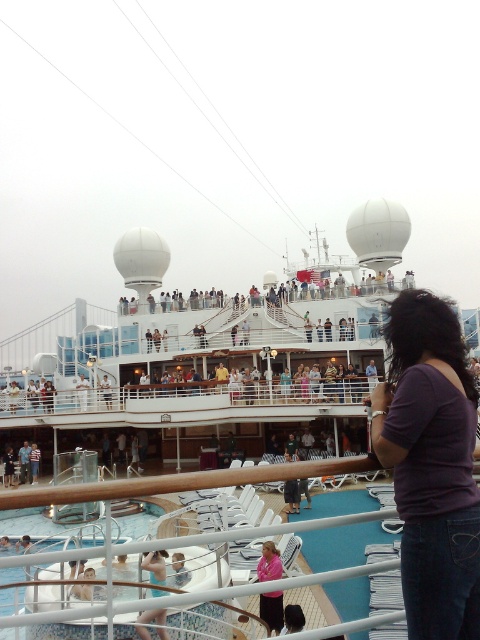
Which is more to the right, purple matte shirt at lower right or pink fabric shirt at lower center?

Positioned to the right is purple matte shirt at lower right.

Looking at this image, between purple matte shirt at lower right and pink fabric shirt at lower center, which one appears on the left side from the viewer's perspective?

pink fabric shirt at lower center

Does point (418, 500) come closer to viewer compared to point (280, 602)?

Yes.

Find the location of `purple matte shirt at lower right`. purple matte shirt at lower right is located at coordinates (432, 465).

Between purple matte shirt at lower right and light blue swimsuit at lower center, which one has more height?

Standing taller between the two is purple matte shirt at lower right.

The image size is (480, 640). In order to click on purple matte shirt at lower right in this screenshot , I will do `click(432, 465)`.

Is point (276, 561) positioned after point (152, 563)?

Yes, it is behind point (152, 563).

Can you confirm if pink fabric shirt at lower center is wider than light blue swimsuit at lower center?

In fact, pink fabric shirt at lower center might be narrower than light blue swimsuit at lower center.

Where is `pink fabric shirt at lower center`? pink fabric shirt at lower center is located at coordinates click(x=272, y=609).

The height and width of the screenshot is (640, 480). I want to click on pink fabric shirt at lower center, so click(272, 609).